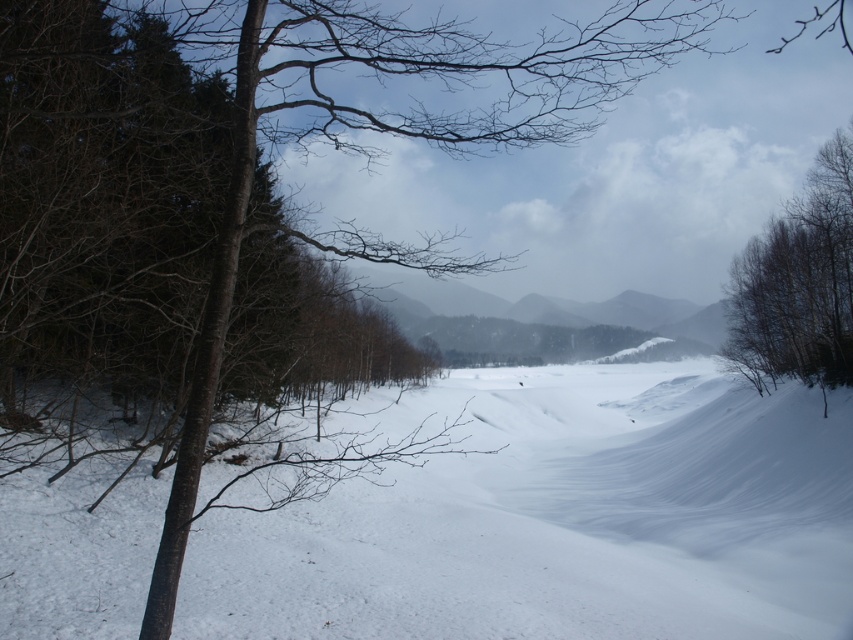
Does white snow at center have a lesser width compared to gray matte mountain at center?

Incorrect, white snow at center's width is not less than gray matte mountain at center's.

Does point (107, 541) come closer to viewer compared to point (572, 317)?

Yes, point (107, 541) is closer to viewer.

Who is more forward, (93, 582) or (541, 307)?

Point (93, 582) is more forward.

This screenshot has height=640, width=853. Identify the location of white snow at center. (556, 518).

Which is above, white snow at center or brown textured tree at right?

Positioned higher is brown textured tree at right.

Does white snow at center have a greater width compared to brown textured tree at right?

Indeed, white snow at center has a greater width compared to brown textured tree at right.

Identify the location of white snow at center. This screenshot has width=853, height=640. (556, 518).

Is point (845, 230) behind point (656, 333)?

No, (845, 230) is in front of (656, 333).

From the picture: Can you confirm if brown textured tree at right is positioned to the left of gray matte mountain at center?

In fact, brown textured tree at right is to the right of gray matte mountain at center.

Locate an element on the screen. brown textured tree at right is located at coordinates (798, 282).